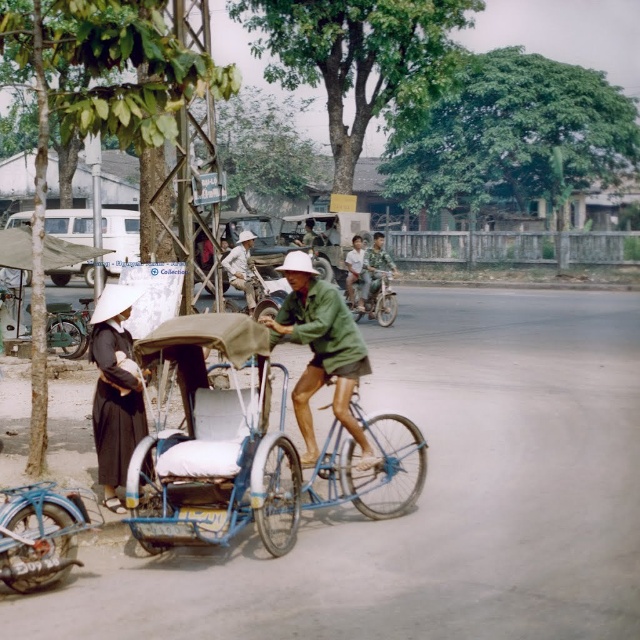
You are a delivery person who needs to carry a package from the store to a nearby park. The store has both a metallic silver motorcycle at center and a light brown wooden stick at center available. Which one would be more suitable for carrying the package efficiently?

The metallic silver motorcycle at center is more suitable for carrying the package efficiently because it has a larger size compared to the light brown wooden stick at center, making it easier to transport heavier items.

You are a delivery person who needs to park your metallic silver motorcycle at center. The parking spot is at point with coordinates (374,300). Can you safely park your motorcycle there?

The point (374,300) marks the metallic silver motorcycle at center, so you cannot park there as the spot is already occupied by the motorcycle.